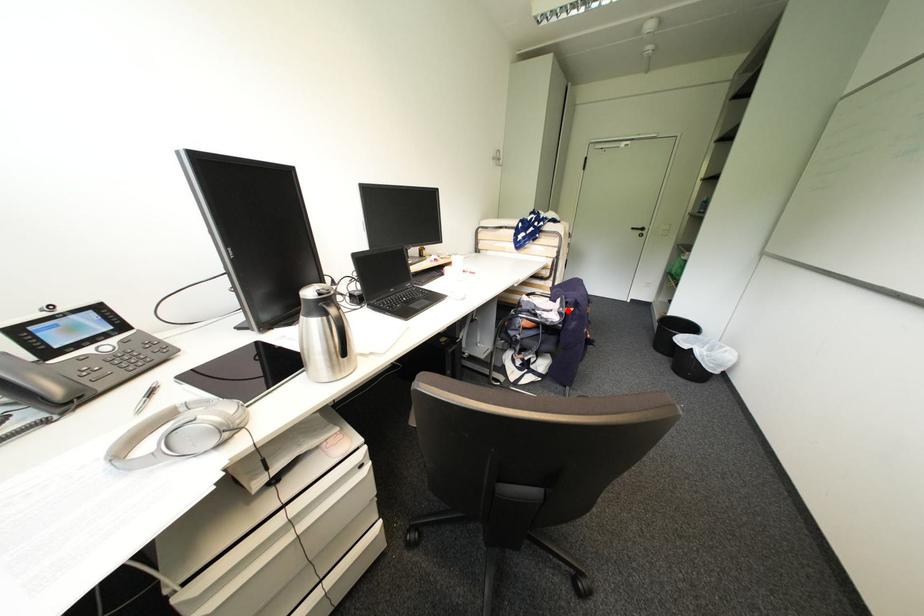
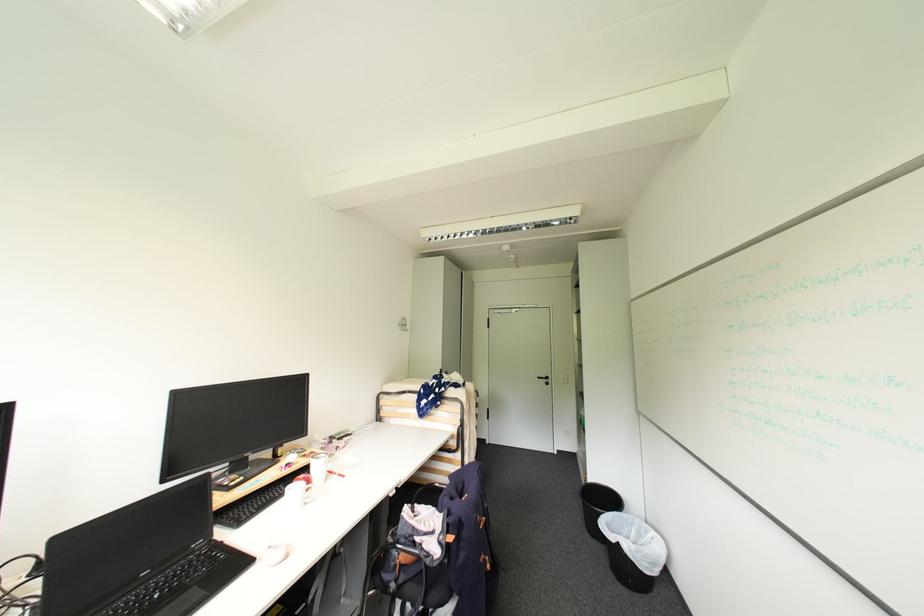
Find the pixel in the second image that matches the highlighted location in the first image.

(447, 538)